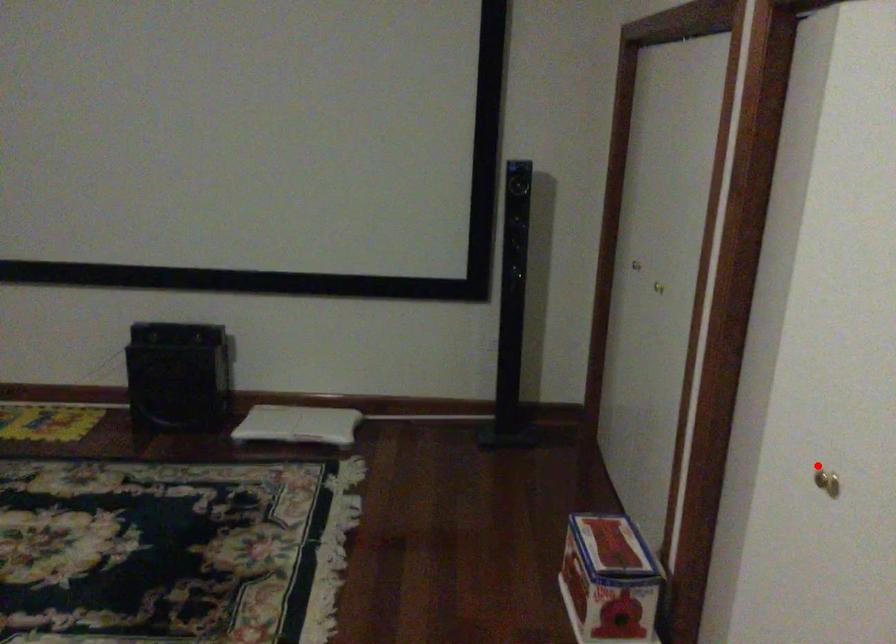
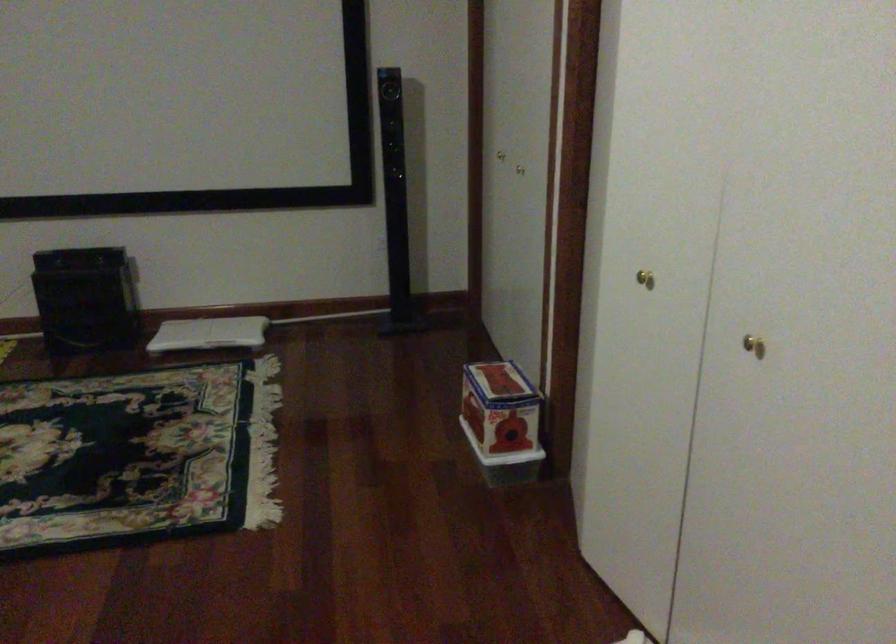
In the second image, find the point that corresponds to the highlighted location in the first image.

(644, 279)